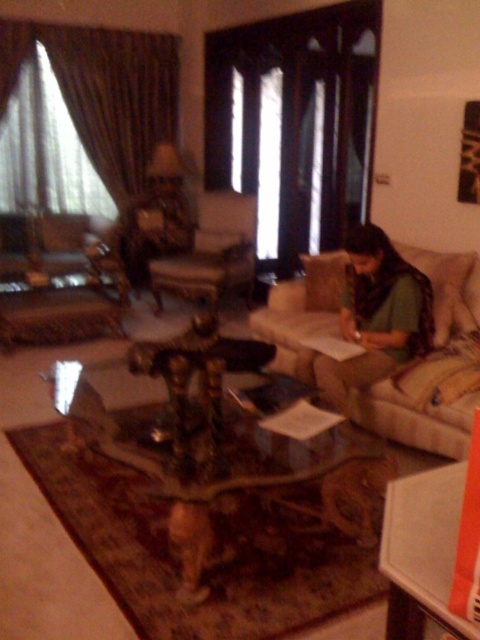
You are planning to place a large potted plant between the beige fabric couch at center and the green fabric person at right. Considering their heights, which object should the plant be placed closer to in order to maintain visual balance?

The beige fabric couch at center is much taller than the green fabric person at right, so the large potted plant should be placed closer to the green fabric person at right to achieve visual balance.

You are a guest entering the living room and want to place a tall potted plant on the transparent glass table at center or the beige fabric couch at center. Which surface can support the plant without it being too unstable?

→ The beige fabric couch at center is taller than the transparent glass table at center, so placing the tall potted plant on the beige fabric couch at center would provide a more stable base since it has a larger surface area and height to balance the plant.

You are a delivery person holding a package that is 1 meter long. You need to place it on the transparent glass table at center or the beige fabric couch at center. Which surface can accommodate the package without overhanging?

The transparent glass table at center is 1.01 meters away from the beige fabric couch at center. However, the distance between them doesn not determine the table or couch size. Without information about their dimensions, it is impossible to determine which surface can fit the 1 meter long package.